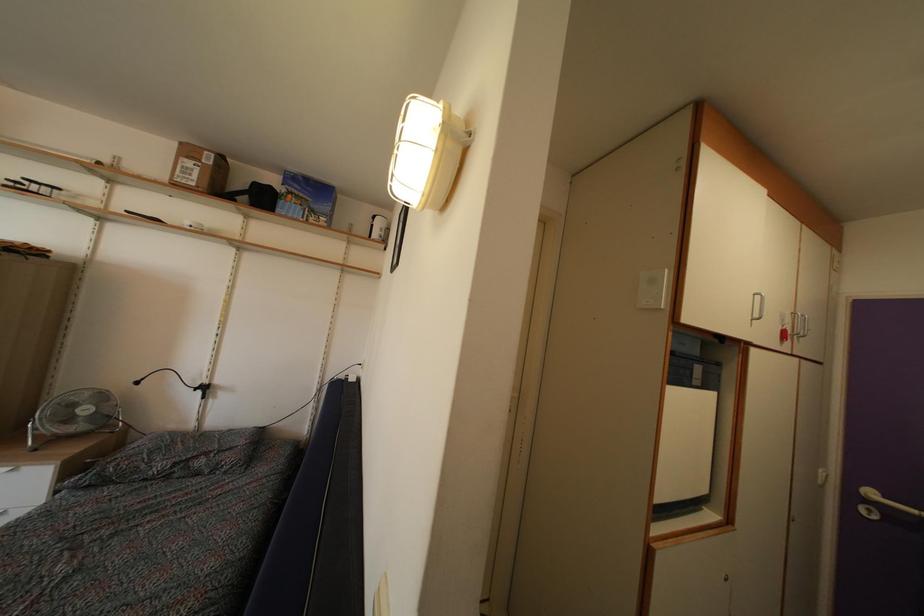
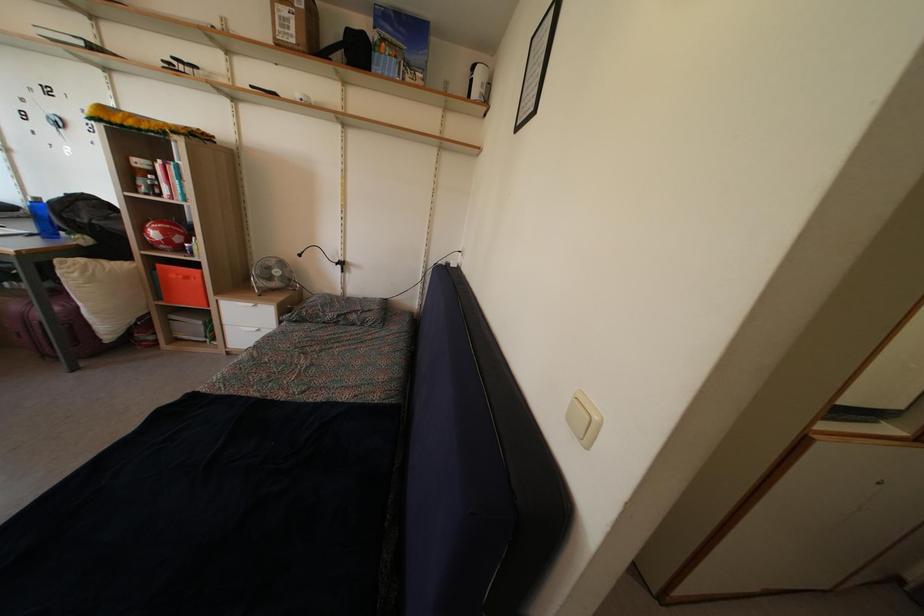
Question: In a continuous first-person perspective shot, in which direction is the camera moving?

Choices:
 (A) Left
 (B) Right
 (C) Forward
 (D) Backward

Answer: (A)